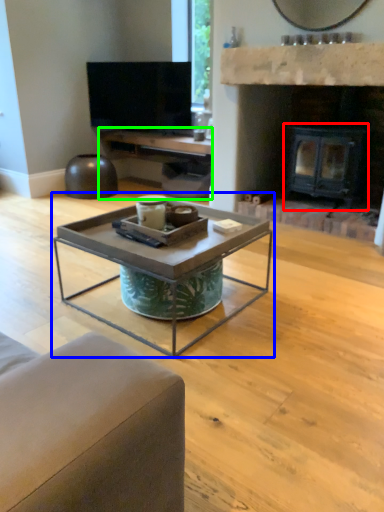
Question: Considering the real-world distances, which object is farthest from fireplace (highlighted by a red box)? coffee table (highlighted by a blue box) or entertainment center (highlighted by a green box)?

Choices:
 (A) coffee table
 (B) entertainment center

Answer: (A)